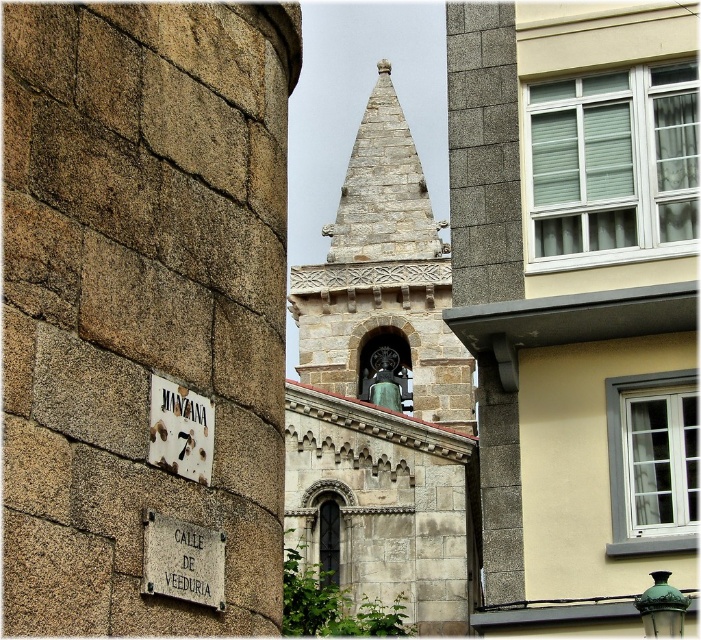
From the picture: You are standing at the point with coordinates point (360, 353) and want to walk to the point with coordinates point (205, 410). Which direction should you move to reach your destination?

To reach point (205, 410) from point (360, 353), you should move downward and to the right since the destination is lower and further to the right on the coordinate plane.

Consider the image. You are standing in the urban scene described. You want to take a photo of the gray stone church at center. Where should you position yourself to ensure the church is centered in your camera frame?

A: To center the gray stone church at center in your camera frame, position yourself directly in front of the church at the coordinates indicated by the 2D location point at (578, 301).